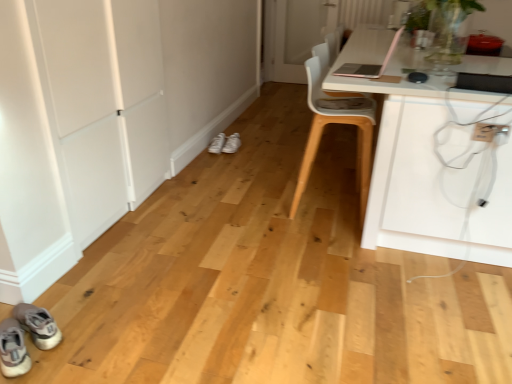
Question: From the image's perspective, would you say white plastic chair at upper right is shown under white glass door at center, which is the second door from bottom to top?

Choices:
 (A) no
 (B) yes

Answer: (B)

Question: From a real-world perspective, is white plastic chair at upper right positioned over white glass door at center, which is the second door from bottom to top, based on gravity?

Choices:
 (A) no
 (B) yes

Answer: (A)

Question: Is white plastic chair at upper right thinner than white glass door at center, which is the second door from bottom to top?

Choices:
 (A) no
 (B) yes

Answer: (A)

Question: Considering the relative sizes of white plastic chair at upper right and white glass door at center, which is the first door from right to left, in the image provided, is white plastic chair at upper right smaller than white glass door at center, which is the first door from right to left,?

Choices:
 (A) yes
 (B) no

Answer: (B)

Question: From the image's perspective, is white plastic chair at upper right over white glass door at center, placed as the 2th door when sorted from front to back?

Choices:
 (A) yes
 (B) no

Answer: (B)

Question: Is white glass door at center, which is the first door from right to left, inside white plastic chair at upper right?

Choices:
 (A) no
 (B) yes

Answer: (A)

Question: Is white plastic electric outlet at lower right shorter than white glass door at center, the first door when ordered from back to front?

Choices:
 (A) no
 (B) yes

Answer: (B)

Question: From the image's perspective, is white plastic electric outlet at lower right located above white glass door at center, placed as the 2th door when sorted from front to back?

Choices:
 (A) no
 (B) yes

Answer: (A)

Question: From the image's perspective, is white plastic electric outlet at lower right located beneath white glass door at center, which is the second door from bottom to top?

Choices:
 (A) no
 (B) yes

Answer: (B)

Question: From a real-world perspective, is white plastic electric outlet at lower right over white glass door at center, which is the second door from bottom to top?

Choices:
 (A) yes
 (B) no

Answer: (A)

Question: Can you confirm if white plastic electric outlet at lower right is smaller than white glass door at center, the first door when ordered from back to front?

Choices:
 (A) no
 (B) yes

Answer: (B)

Question: Is white plastic electric outlet at lower right directly adjacent to white glass door at center, the first door when ordered from back to front?

Choices:
 (A) yes
 (B) no

Answer: (B)

Question: Is white plastic electric outlet at lower right oriented away from white matte door at left, arranged as the 2th door when viewed from the top?

Choices:
 (A) yes
 (B) no

Answer: (B)